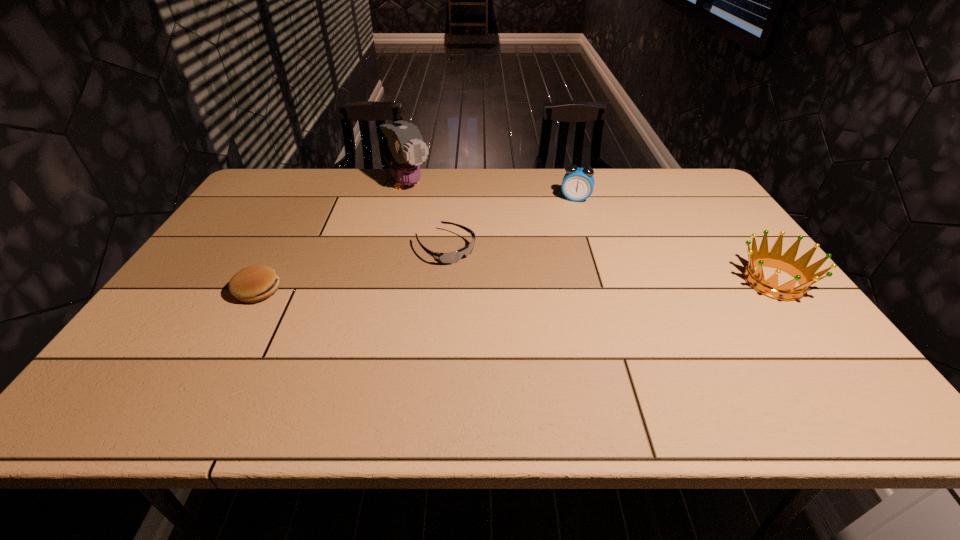
I want to click on free space on the desktop that is between the fourth tallest object and the crown and is positioned at the beak of the bird, so click(x=523, y=286).

At what (x,y) coordinates should I click in order to perform the action: click on vacant spot on the desktop that is between the fourth tallest object and the crown and is positioned on the lenses of the shortest object. Please return your answer as a coordinate pair (x, y). The image size is (960, 540). Looking at the image, I should click on (502, 286).

Image resolution: width=960 pixels, height=540 pixels. I want to click on vacant space on the desktop that is between the second shortest object and the crown and is positioned on the face of the second object from right to left, so click(x=556, y=286).